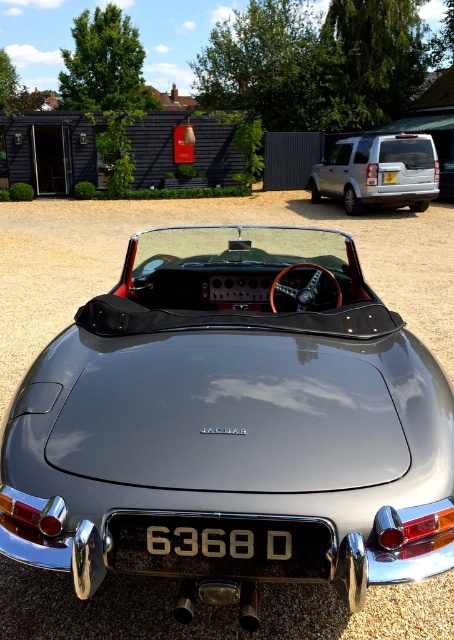
Question: Can you confirm if shiny metallic sports car at center is wider than silver metallic license plate at center?

Choices:
 (A) yes
 (B) no

Answer: (A)

Question: Among these points, which one is farthest from the camera?

Choices:
 (A) (415, 525)
 (B) (393, 170)

Answer: (B)

Question: Which point is closer to the camera?

Choices:
 (A) shiny metallic sports car at center
 (B) silver metallic license plate at center

Answer: (A)

Question: Does shiny metallic sports car at center appear under silver metallic suv at upper right?

Choices:
 (A) yes
 (B) no

Answer: (A)

Question: Which point appears closest to the camera in this image?

Choices:
 (A) (322, 497)
 (B) (319, 166)

Answer: (A)

Question: Is shiny metallic sports car at center above silver metallic suv at upper right?

Choices:
 (A) no
 (B) yes

Answer: (A)